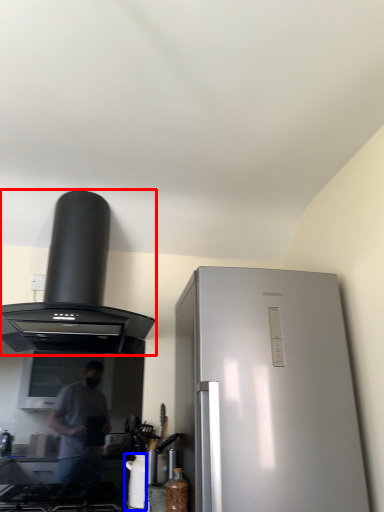
Question: Which point is closer to the camera, kitchen appliance (highlighted by a red box) or appliance (highlighted by a blue box)?

Choices:
 (A) kitchen appliance
 (B) appliance

Answer: (A)